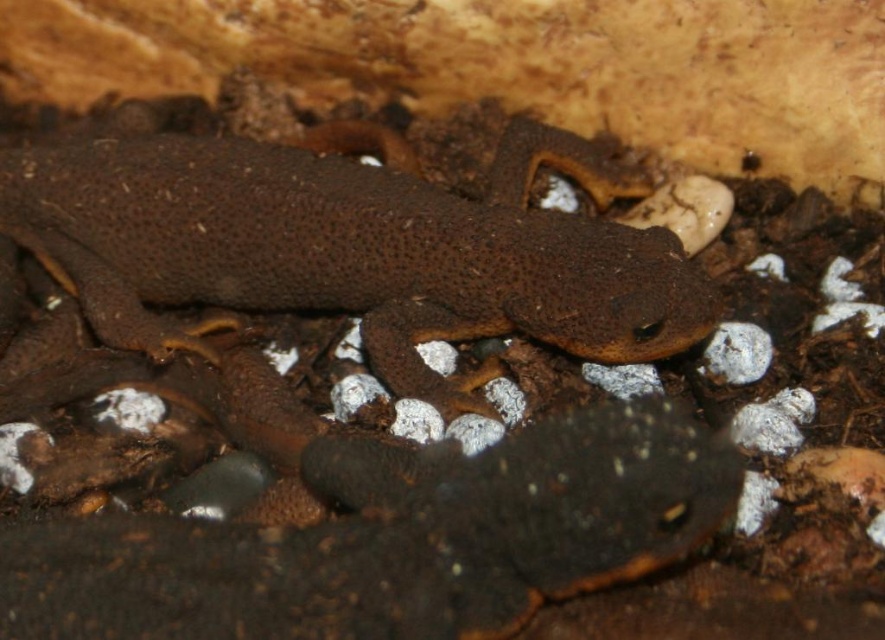
Does brown rough skin lizard at center have a lesser width compared to white matte stone at lower right?

Incorrect, brown rough skin lizard at center's width is not less than white matte stone at lower right's.

Is brown rough skin lizard at center shorter than white matte stone at lower right?

In fact, brown rough skin lizard at center may be taller than white matte stone at lower right.

The image size is (885, 640). I want to click on brown rough skin lizard at center, so click(x=354, y=250).

Where is `brown rough skin lizard at center`? brown rough skin lizard at center is located at coordinates (354, 250).

Measure the distance between smooth brown lizard at center and camera.

smooth brown lizard at center and camera are 28.95 inches apart.

Locate an element on the screen. This screenshot has width=885, height=640. smooth brown lizard at center is located at coordinates (391, 540).

Who is positioned more to the left, brown rough skin lizard at center or smooth brown lizard at center?

From the viewer's perspective, brown rough skin lizard at center appears more on the left side.

Does point (206, 300) come behind point (360, 570)?

Yes, point (206, 300) is behind point (360, 570).

At what (x,y) coordinates should I click in order to perform the action: click on brown rough skin lizard at center. Please return your answer as a coordinate pair (x, y). The height and width of the screenshot is (640, 885). Looking at the image, I should click on (354, 250).